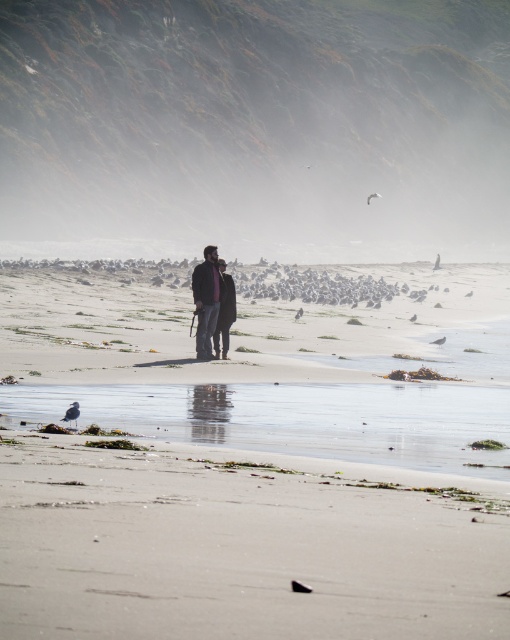
Is foggy mist at upper center taller than smooth sand at lower center?

Yes, foggy mist at upper center is taller than smooth sand at lower center.

Does foggy mist at upper center appear under smooth sand at lower center?

Actually, foggy mist at upper center is above smooth sand at lower center.

Describe the element at coordinates (255, 120) in the screenshot. The image size is (510, 640). I see `foggy mist at upper center` at that location.

Where is `foggy mist at upper center`? The image size is (510, 640). foggy mist at upper center is located at coordinates tap(255, 120).

Does foggy mist at upper center appear over matte black jacket at center?

Yes, foggy mist at upper center is above matte black jacket at center.

Does foggy mist at upper center have a smaller size compared to matte black jacket at center?

No.

Does point (83, 74) come behind point (217, 273)?

That is True.

Find the location of a particular element. This screenshot has width=510, height=640. foggy mist at upper center is located at coordinates (255, 120).

Between smooth sand at lower center and matte black jacket at center, which one is positioned higher?

matte black jacket at center is above.

Which is below, smooth sand at lower center or matte black jacket at center?

smooth sand at lower center

Image resolution: width=510 pixels, height=640 pixels. What do you see at coordinates (241, 547) in the screenshot?
I see `smooth sand at lower center` at bounding box center [241, 547].

Find the location of `smooth sand at lower center`. smooth sand at lower center is located at coordinates (241, 547).